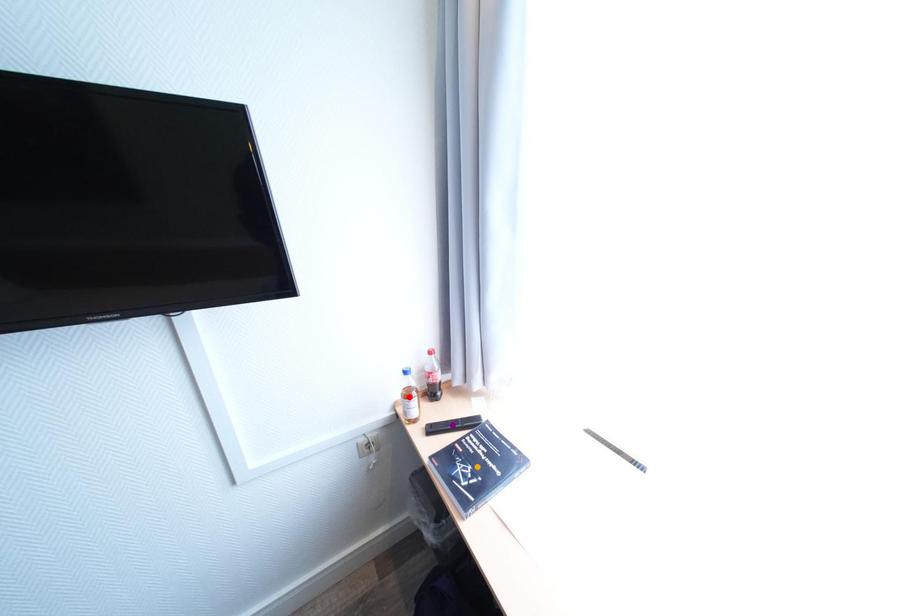
Order these from nearest to farthest:
red point | purple point | orange point

purple point < red point < orange point